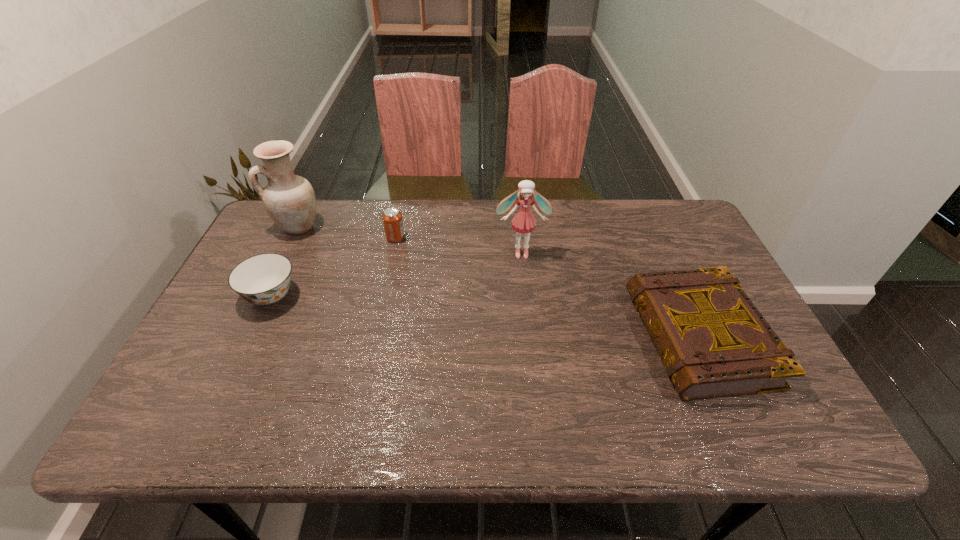
Find the location of a particular element. unoccupied position between the doll and the pottery is located at coordinates (410, 239).

Locate an element on the screen. object that ranks as the third closest to the third object from right to left is located at coordinates (523, 221).

Identify the location of object that is the fourth closest to the hardback book. (289, 199).

I want to click on vacant space that satisfies the following two spatial constraints: 1. on the front side of the rightmost object; 2. on the left side of the soup bowl, so click(x=252, y=338).

Identify the location of vacant area in the image that satisfies the following two spatial constraints: 1. on the front-facing side of the hardback book; 2. on the left side of the third nearest object. The image size is (960, 540). (530, 338).

Where is `vacant space that satisfies the following two spatial constraints: 1. on the front side of the pottery; 2. on the right side of the soup bowl`? vacant space that satisfies the following two spatial constraints: 1. on the front side of the pottery; 2. on the right side of the soup bowl is located at coordinates (265, 295).